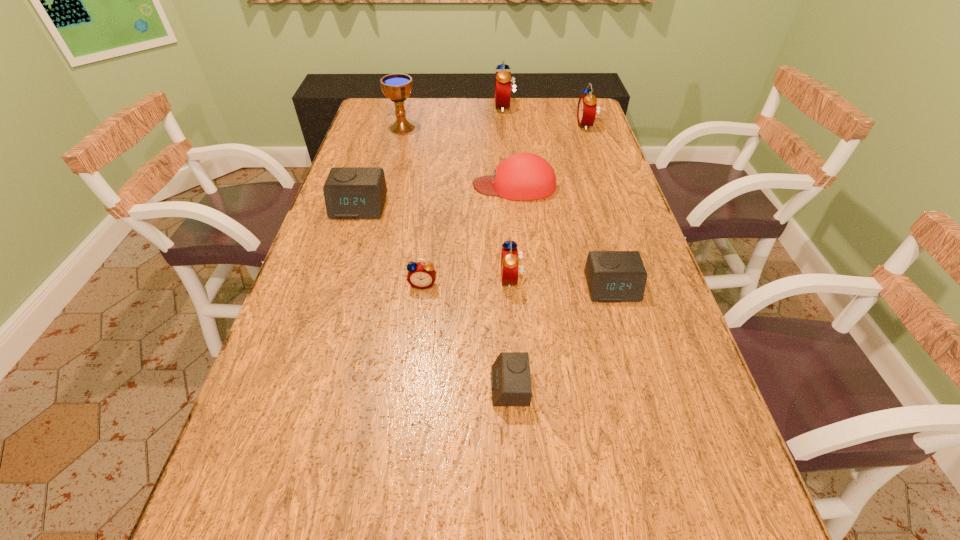
At what (x,y) coordinates should I click in order to perform the action: click on unoccupied position between the second farthest alarm clock and the third biggest red alarm clock. Please return your answer as a coordinate pair (x, y). Image resolution: width=960 pixels, height=540 pixels. Looking at the image, I should click on (549, 202).

Identify which object is the sixth nearest to the third biggest red alarm clock. Please provide its 2D coordinates. Your answer should be formatted as a tuple, i.e. [(x, y)], where the tuple contains the x and y coordinates of a point satisfying the conditions above.

[(397, 87)]

Image resolution: width=960 pixels, height=540 pixels. In order to click on the fourth closest object relative to the farthest alarm clock in this screenshot , I will do [x=350, y=192].

The height and width of the screenshot is (540, 960). What are the coordinates of `alarm clock that is the fifth closest to the chalice` in the screenshot? It's located at (509, 255).

Find the location of a particular element. This screenshot has height=540, width=960. the second closest alarm clock relative to the chalice is located at coordinates (350, 192).

Locate an element on the screen. This screenshot has height=540, width=960. the third closest red alarm clock to the smallest black alarm clock is located at coordinates pos(586,112).

At what (x,y) coordinates should I click in order to perform the action: click on red alarm clock that stands as the second closest to the baseball cap. Please return your answer as a coordinate pair (x, y). Looking at the image, I should click on (586, 112).

In order to click on black alarm clock identified as the second closest to the baseball cap in this screenshot , I will do `click(612, 276)`.

Identify which black alarm clock is the third nearest to the third tallest object. Please provide its 2D coordinates. Your answer should be formatted as a tuple, i.e. [(x, y)], where the tuple contains the x and y coordinates of a point satisfying the conditions above.

[(511, 385)]

The height and width of the screenshot is (540, 960). What are the coordinates of `blank space that satisfies the following two spatial constraints: 1. on the front-facing side of the second biggest red alarm clock; 2. on the front-facing side of the rightmost black alarm clock` in the screenshot? It's located at (643, 288).